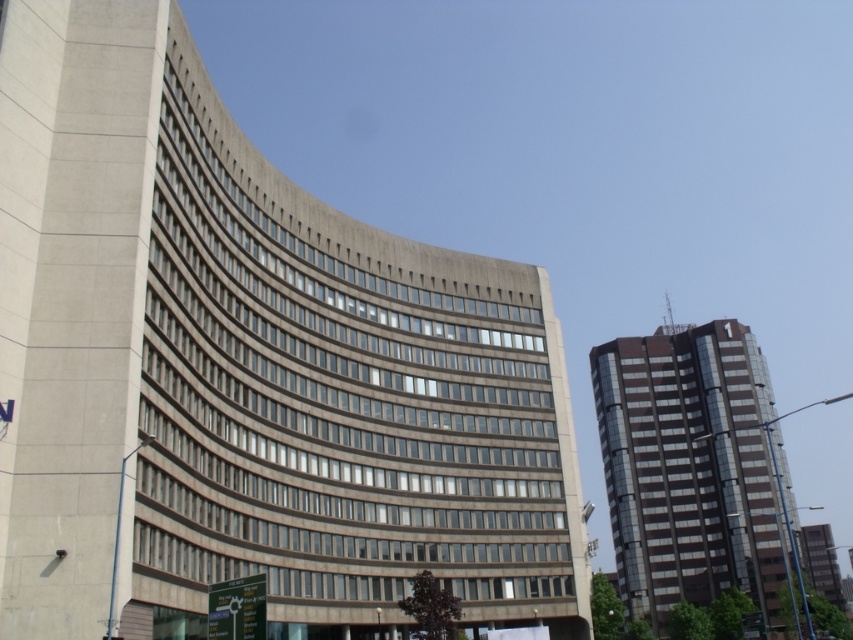
You are standing in the urban landscape shown. You want to reach the point at coordinates (x=514, y=292). Can you estimate how far you need to walk to get there?

The point at coordinates (x=514, y=292) is 230.35 feet away from the camera, so you need to walk approximately 230.35 feet to reach it.

You are standing in the middle of the street between the concrete building at center and the shiny glass building at right. Which building is closer to your left side?

The concrete building at center is positioned on the left side of the shiny glass building at right, so when standing between them, the concrete building at center would be to your left side.

You are standing in the middle of the city square between the two buildings. You want to take a photo of the shiny glass building at right and the glassy reflective tower at right. Which building should you focus on first if you want to capture both in one frame without moving your camera?

You should focus on the shiny glass building at right first because it is closer to the viewer than the glassy reflective tower at right, so adjusting focus to the closer object will ensure both are in the frame.